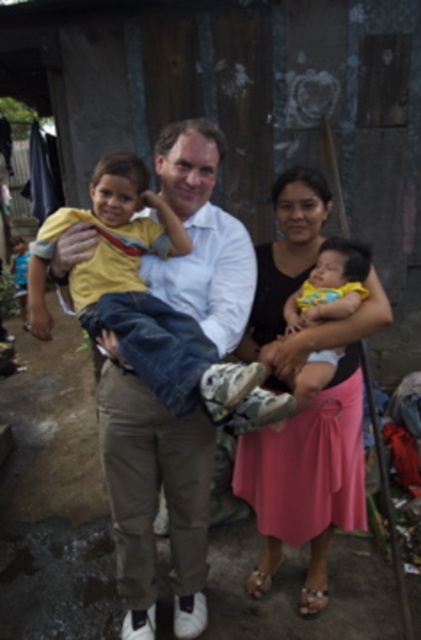
Between yellow matte shirt at center and yellow fabric baby at center, which one has less height?

With less height is yellow fabric baby at center.

The height and width of the screenshot is (640, 421). Describe the element at coordinates (146, 304) in the screenshot. I see `yellow matte shirt at center` at that location.

Describe the element at coordinates (146, 304) in the screenshot. I see `yellow matte shirt at center` at that location.

You are a GUI agent. You are given a task and a screenshot of the screen. Output one action in this format:
    pyautogui.click(x=<x>, y=<y>)
    Task: Click on the yellow matte shirt at center
    
    Given the screenshot: What is the action you would take?
    pyautogui.click(x=146, y=304)

Does pink fabric skirt at lower right appear on the left side of yellow fabric baby at center?

Indeed, pink fabric skirt at lower right is positioned on the left side of yellow fabric baby at center.

Does pink fabric skirt at lower right have a smaller size compared to yellow fabric baby at center?

Incorrect, pink fabric skirt at lower right is not smaller in size than yellow fabric baby at center.

Does point (279, 500) lie behind point (322, 388)?

Yes.

Where is `pink fabric skirt at lower right`? This screenshot has height=640, width=421. pink fabric skirt at lower right is located at coordinates (309, 403).

Is khaki pants at center shorter than matte yellow shirt at center?

No.

Can you confirm if khaki pants at center is positioned to the right of matte yellow shirt at center?

No, khaki pants at center is not to the right of matte yellow shirt at center.

Who is more distant from viewer, (138, 516) or (202, 164)?

Point (138, 516)

Image resolution: width=421 pixels, height=640 pixels. Identify the location of khaki pants at center. (154, 497).